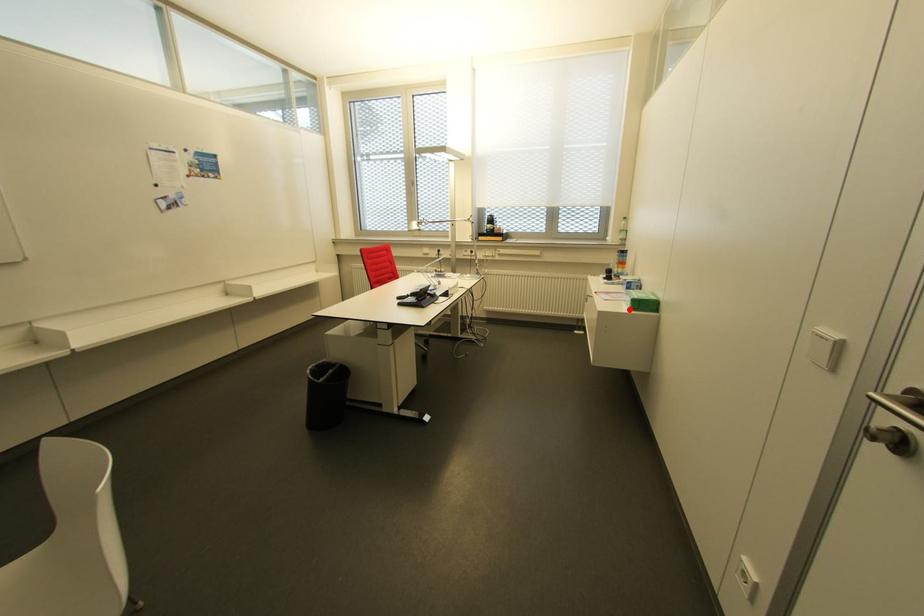
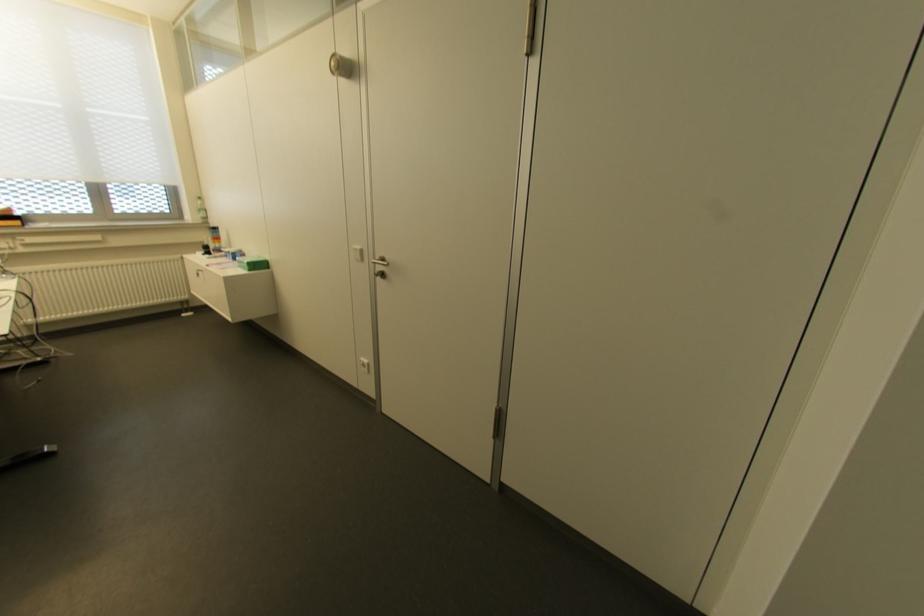
Where in the second image is the point corresponding to the highlighted location from the first image?

(248, 270)